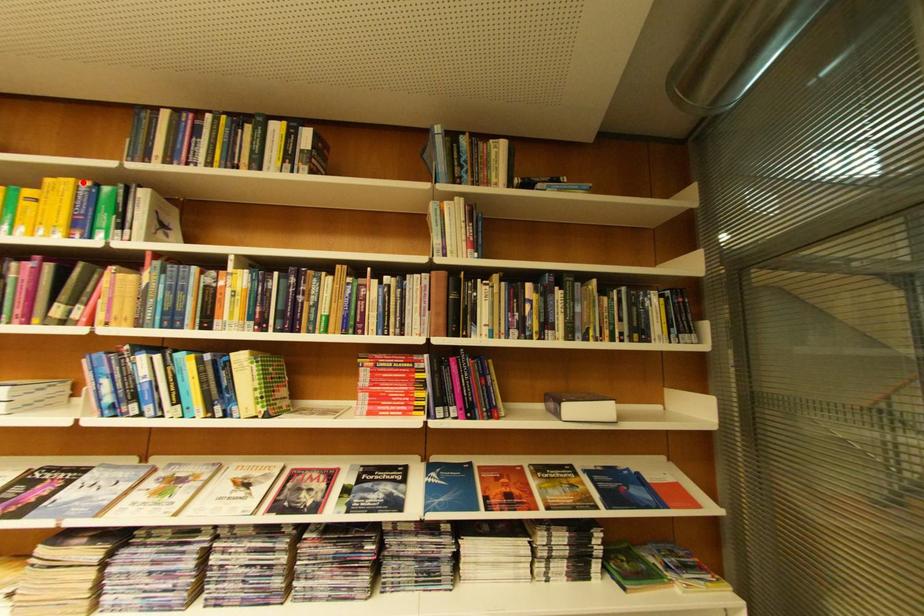
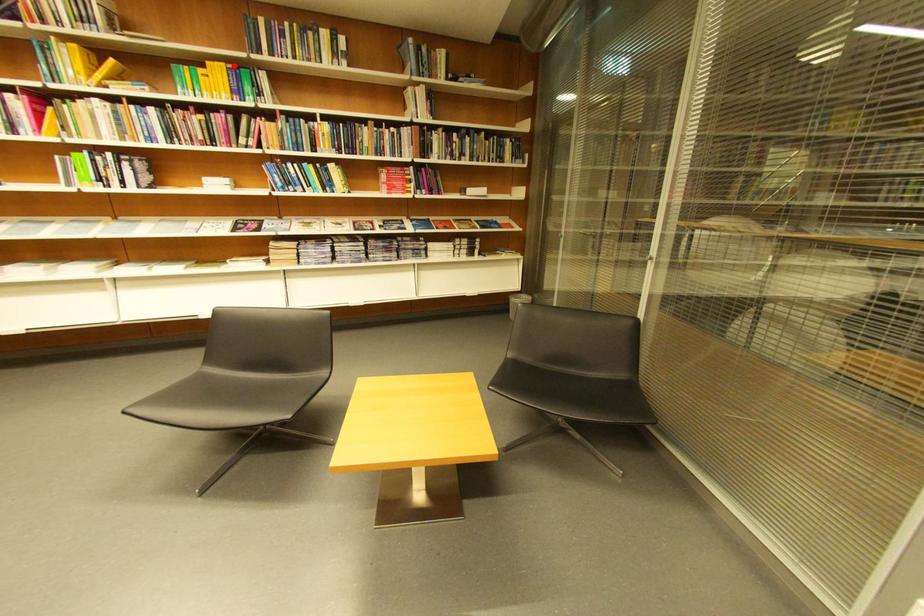
I am providing you with two images of the same scene from different viewpoints. A red point is marked on the first image and another point is marked on the second image. Are the points marked in image1 and image2 representing the same 3D position?

Yes